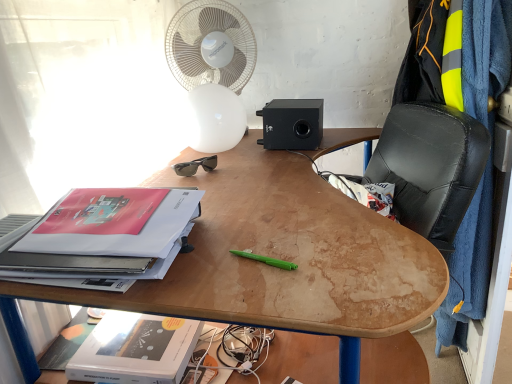
Identify the location of free space that is to the left of green plastic pen at center. Image resolution: width=512 pixels, height=384 pixels. (186, 267).